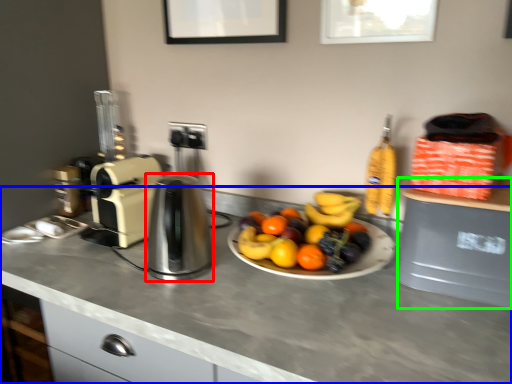
Question: Considering the real-world distances, which object is farthest from kitchen appliance (highlighted by a red box)? countertop (highlighted by a blue box) or appliance (highlighted by a green box)?

Choices:
 (A) countertop
 (B) appliance

Answer: (B)